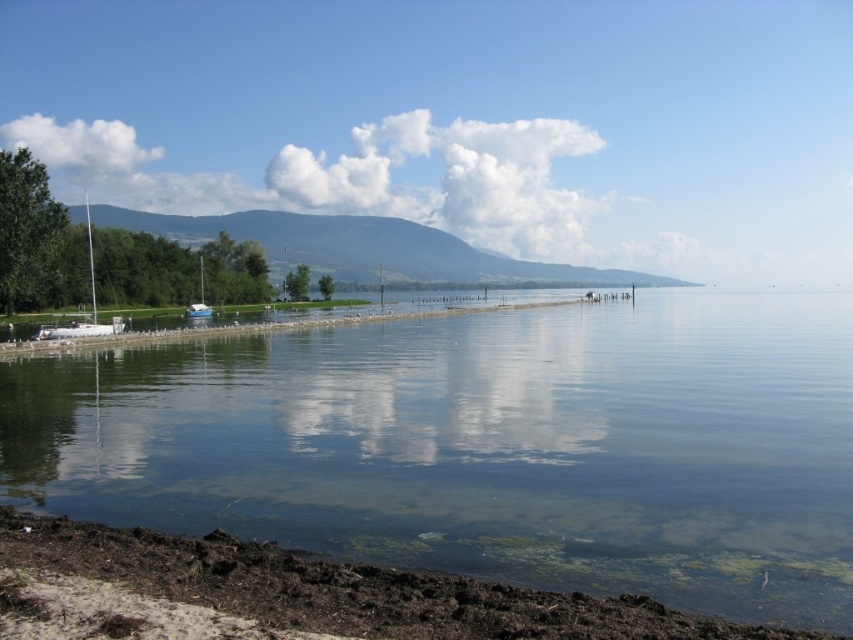
You are standing at the edge of the lake and want to cross to the other side. You notice there are clear water at lower left and brown dirt at lower left. Which path would allow you to walk across without getting your feet wet?

The brown dirt at lower left is the path you can walk on without getting wet because the clear water at lower left is likely part of the lake where the water is deeper or more present.